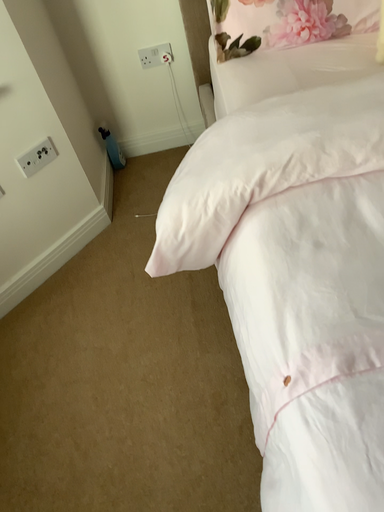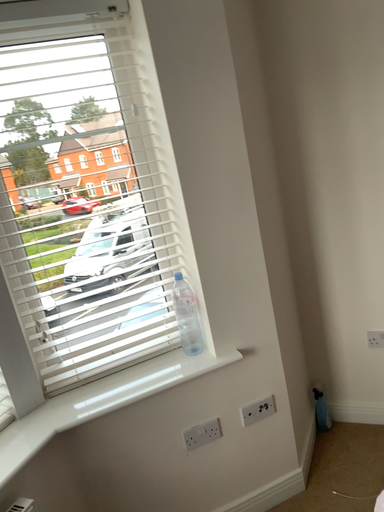
Question: Which way did the camera rotate in the video?

Choices:
 (A) rotated upward
 (B) rotated downward

Answer: (A)